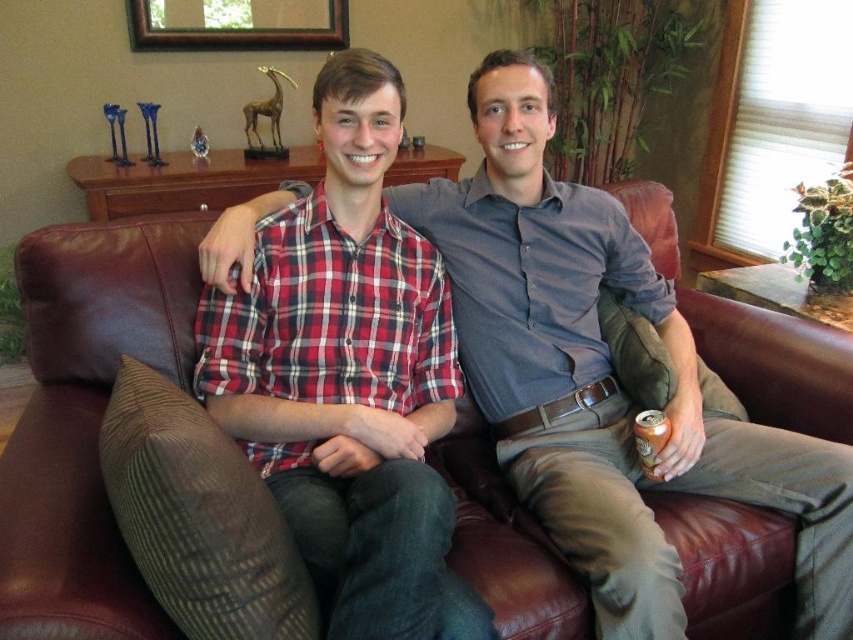
Is point (495, 493) less distant than point (151, 35)?

Yes, point (495, 493) is closer to viewer.

Which is more to the left, leather couch at center or brown wooden picture frame at upper center?

brown wooden picture frame at upper center is more to the left.

You are a GUI agent. You are given a task and a screenshot of the screen. Output one action in this format:
    pyautogui.click(x=<x>, y=<y>)
    Task: Click on the leather couch at center
    The height and width of the screenshot is (640, 853).
    Given the screenshot: What is the action you would take?
    pyautogui.click(x=86, y=419)

Which is behind, point (57, 301) or point (399, 339)?

Positioned behind is point (57, 301).

Is leather couch at center closer to the viewer compared to red plaid shirt at center?

Yes, leather couch at center is in front of red plaid shirt at center.

Locate an element on the screen. leather couch at center is located at coordinates (86, 419).

Identify the location of leather couch at center. This screenshot has height=640, width=853. (86, 419).

Can you confirm if red plaid shirt at center is taller than brown wooden picture frame at upper center?

Correct, red plaid shirt at center is much taller as brown wooden picture frame at upper center.

Is red plaid shirt at center wider than brown wooden picture frame at upper center?

Incorrect, red plaid shirt at center's width does not surpass brown wooden picture frame at upper center's.

Does point (364, 152) come in front of point (241, 8)?

Yes.

This screenshot has width=853, height=640. Identify the location of red plaid shirt at center. (357, 381).